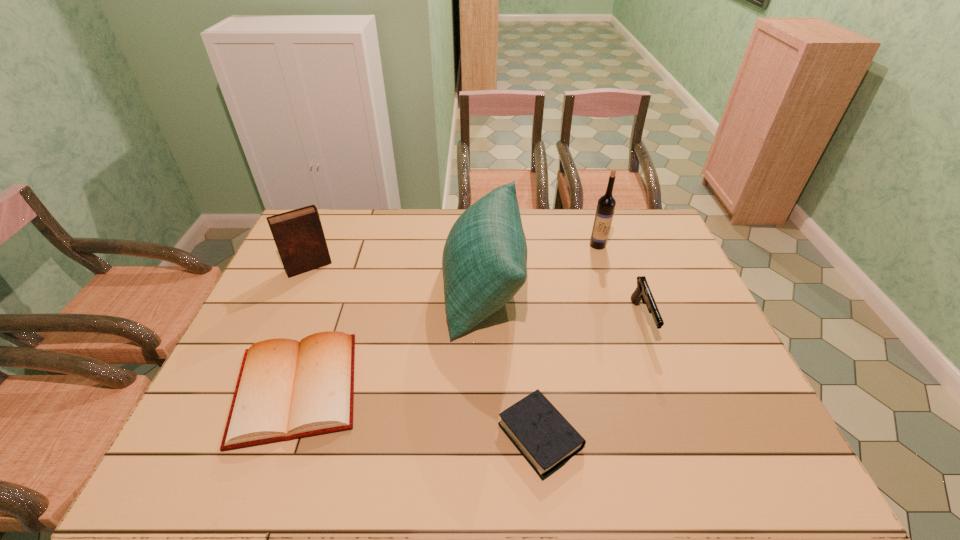
Locate an element on the screen. This screenshot has width=960, height=540. vacant space at the right edge of the desktop is located at coordinates (693, 312).

Identify the location of vacant space at the near left corner of the desktop. This screenshot has height=540, width=960. coord(197,458).

Locate an element on the screen. The width and height of the screenshot is (960, 540). free spot between the second object from right to left and the cushion is located at coordinates (540, 266).

Identify the location of vacant region between the rightmost Bible and the gun. This screenshot has width=960, height=540. (591, 378).

Where is `blank region between the rightmost Bible and the cushion`? This screenshot has height=540, width=960. blank region between the rightmost Bible and the cushion is located at coordinates (512, 361).

At what (x,y) coordinates should I click in order to perform the action: click on vacant space in between the cushion and the fourth shortest object. Please return your answer as a coordinate pair (x, y). Looking at the image, I should click on (396, 276).

Locate which object is the fourth closest to the wine bottle. Please provide its 2D coordinates. Your answer should be formatted as a tuple, i.e. [(x, y)], where the tuple contains the x and y coordinates of a point satisfying the conditions above.

[(286, 389)]

Where is `object that is the fourth nearest to the rightmost Bible`? This screenshot has height=540, width=960. object that is the fourth nearest to the rightmost Bible is located at coordinates pyautogui.click(x=606, y=204).

At what (x,y) coordinates should I click in order to perform the action: click on Bible that stands as the second closest to the farthest Bible. Please return your answer as a coordinate pair (x, y). The image size is (960, 540). Looking at the image, I should click on (539, 431).

Where is `Bible that is the closest to the rightmost Bible`? This screenshot has height=540, width=960. Bible that is the closest to the rightmost Bible is located at coordinates (286, 389).